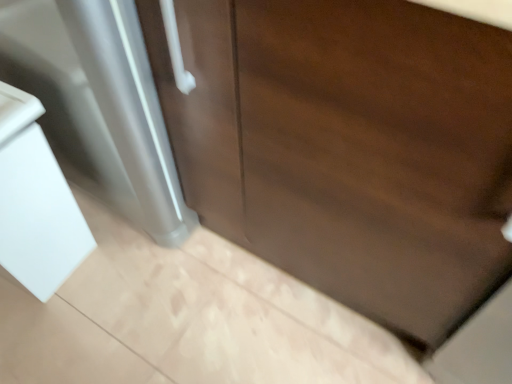
Question: Considering the relative sizes of white glossy sink at lower left and dark wood door at center in the image provided, is white glossy sink at lower left bigger than dark wood door at center?

Choices:
 (A) no
 (B) yes

Answer: (A)

Question: From the image's perspective, does white glossy sink at lower left appear higher than dark wood door at center?

Choices:
 (A) no
 (B) yes

Answer: (A)

Question: Is white glossy sink at lower left facing away from dark wood door at center?

Choices:
 (A) yes
 (B) no

Answer: (B)

Question: Considering the relative positions of white glossy sink at lower left and dark wood door at center in the image provided, is white glossy sink at lower left to the right of dark wood door at center from the viewer's perspective?

Choices:
 (A) no
 (B) yes

Answer: (A)

Question: Does white glossy sink at lower left come in front of dark wood door at center?

Choices:
 (A) yes
 (B) no

Answer: (B)

Question: Is white glossy sink at lower left with dark wood door at center?

Choices:
 (A) no
 (B) yes

Answer: (A)

Question: Is dark wood door at center positioned with its back to white glossy sink at lower left?

Choices:
 (A) no
 (B) yes

Answer: (A)

Question: Is dark wood door at center positioned far away from white glossy sink at lower left?

Choices:
 (A) no
 (B) yes

Answer: (A)

Question: Is dark wood door at center outside white glossy sink at lower left?

Choices:
 (A) yes
 (B) no

Answer: (A)

Question: Considering the relative sizes of dark wood door at center and white glossy sink at lower left in the image provided, is dark wood door at center taller than white glossy sink at lower left?

Choices:
 (A) yes
 (B) no

Answer: (A)

Question: Is dark wood door at center beside white glossy sink at lower left?

Choices:
 (A) no
 (B) yes

Answer: (A)

Question: Is dark wood door at center aimed at white glossy sink at lower left?

Choices:
 (A) no
 (B) yes

Answer: (A)

Question: Based on their positions, is dark wood door at center located to the left or right of white glossy sink at lower left?

Choices:
 (A) left
 (B) right

Answer: (B)